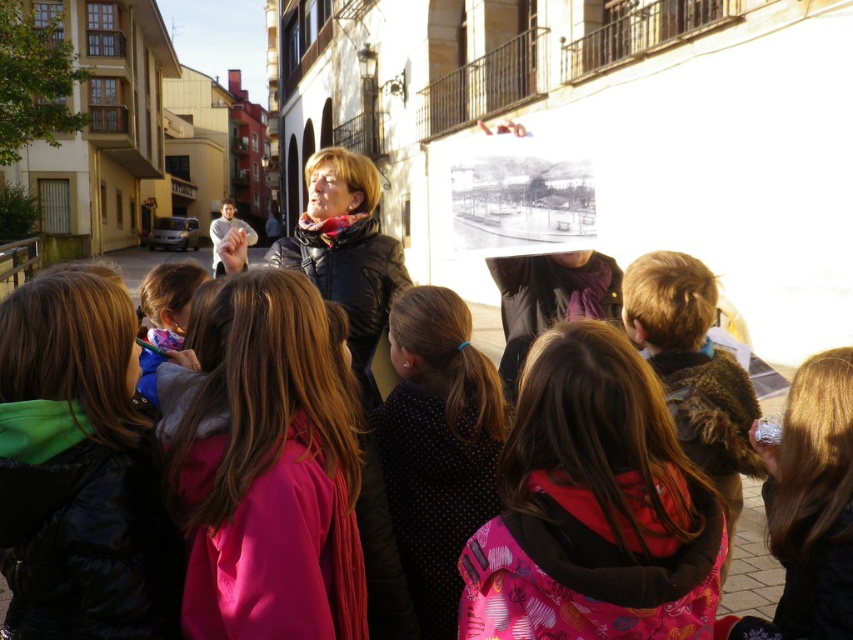
Question: Can you confirm if pink fabric at center is positioned above polka dot fabric at center?

Choices:
 (A) no
 (B) yes

Answer: (A)

Question: Which object is positioned closest to the brown fuzzy coat at right?

Choices:
 (A) blue fabric jacket at lower left
 (B) polka dot fabric at center

Answer: (B)

Question: Observing the image, what is the correct spatial positioning of pink fleece jacket at center in reference to black puffy jacket at center?

Choices:
 (A) below
 (B) above

Answer: (A)

Question: Which is nearer to the brown hair at right?

Choices:
 (A) black puffy jacket at center
 (B) pink fleece jacket at center
 (C) brown fuzzy coat at right

Answer: (C)

Question: Among these points, which one is farthest from the camera?

Choices:
 (A) (55, 552)
 (B) (646, 268)
 (C) (618, 589)
 (D) (769, 445)

Answer: (B)

Question: From the image, what is the correct spatial relationship of polka dot fabric at center in relation to brown hair at right?

Choices:
 (A) above
 (B) below

Answer: (A)